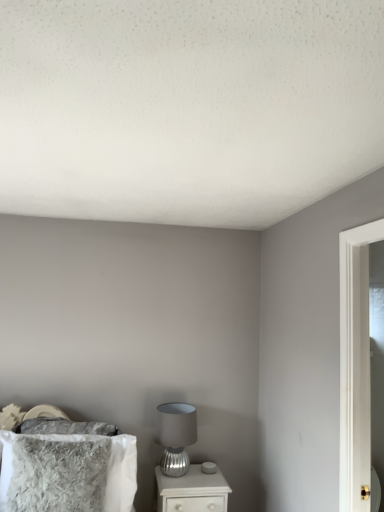
Question: From a real-world perspective, is satin silver table lamp at lower center positioned above or below fuzzy gray pillow at lower left?

Choices:
 (A) above
 (B) below

Answer: (A)

Question: Based on their sizes in the image, would you say satin silver table lamp at lower center is bigger or smaller than fuzzy gray pillow at lower left?

Choices:
 (A) big
 (B) small

Answer: (B)

Question: Estimate the real-world distances between objects in this image. Which object is farther from the white glossy nightstand at lower center?

Choices:
 (A) satin silver table lamp at lower center
 (B) fuzzy gray pillow at lower left

Answer: (B)

Question: Estimate the real-world distances between objects in this image. Which object is closer to the fuzzy gray pillow at lower left?

Choices:
 (A) satin silver table lamp at lower center
 (B) white glossy nightstand at lower center

Answer: (B)